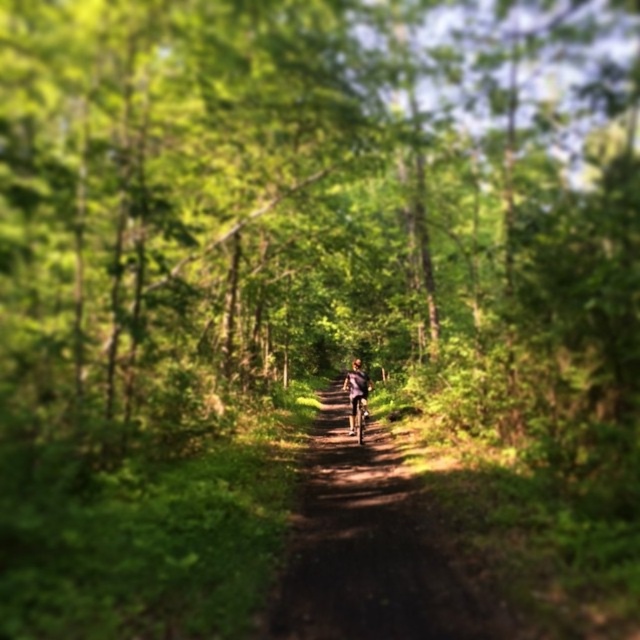
Does point (353, 429) lie in front of point (364, 397)?

No, (353, 429) is behind (364, 397).

Is matte purple jacket at center below shiny metallic bicycle at center?

No.

Is point (352, 429) closer to viewer compared to point (362, 413)?

No.

Find the location of `matte purple jacket at center`. matte purple jacket at center is located at coordinates (356, 392).

Is dirt path at center to the right of shiny metallic bicycle at center from the viewer's perspective?

No, dirt path at center is not to the right of shiny metallic bicycle at center.

Does dirt path at center have a larger size compared to shiny metallic bicycle at center?

Yes.

Find the location of a particular element. This screenshot has height=640, width=640. dirt path at center is located at coordinates (371, 547).

Locate an element on the screen. The width and height of the screenshot is (640, 640). dirt path at center is located at coordinates (371, 547).

Is dirt path at center positioned before matte purple jacket at center?

Yes, dirt path at center is closer to the viewer.

Does point (397, 618) lie in front of point (364, 408)?

Yes.

Locate an element on the screen. The image size is (640, 640). dirt path at center is located at coordinates (371, 547).